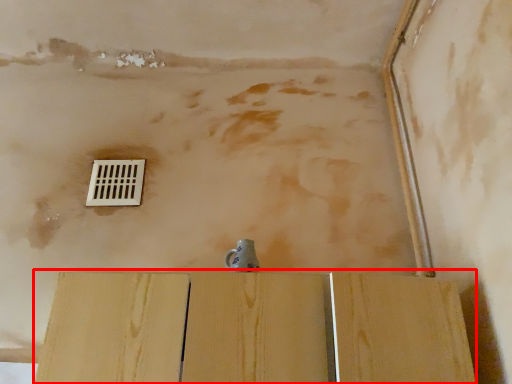
Question: Where is plywood (annotated by the red box) located in relation to window in the image?

Choices:
 (A) right
 (B) left

Answer: (A)